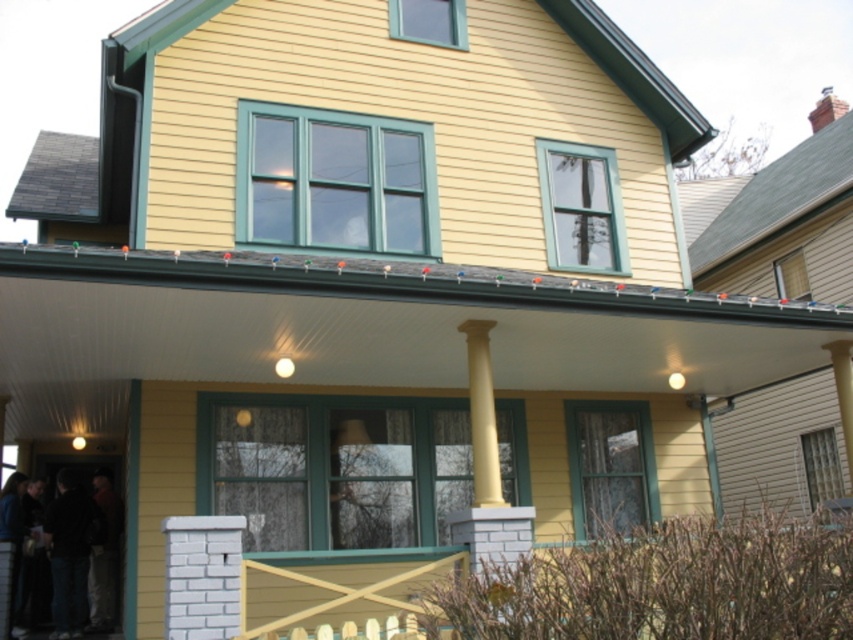
Between dark blue jeans at lower left and dark clothing at entrance, which one appears on the left side from the viewer's perspective?

dark clothing at entrance

Is point (74, 579) positioned before point (57, 611)?

No, (74, 579) is behind (57, 611).

This screenshot has height=640, width=853. What are the coordinates of `dark blue jeans at lower left` in the screenshot? It's located at (73, 548).

Image resolution: width=853 pixels, height=640 pixels. What do you see at coordinates (68, 552) in the screenshot?
I see `dark clothing at entrance` at bounding box center [68, 552].

Is dark clothing at entrance to the left of yellow smooth column at center from the viewer's perspective?

Indeed, dark clothing at entrance is positioned on the left side of yellow smooth column at center.

Is point (74, 515) more distant than point (473, 320)?

Yes, it is.

Find the location of a particular element. This screenshot has width=853, height=640. dark clothing at entrance is located at coordinates (68, 552).

How distant is dark blue jeans at lower left from yellow smooth column at center?

They are 4.94 meters apart.

This screenshot has width=853, height=640. What do you see at coordinates (73, 548) in the screenshot? I see `dark blue jeans at lower left` at bounding box center [73, 548].

Which is behind, point (107, 502) or point (473, 380)?

The point (107, 502) is more distant.

I want to click on dark blue jeans at lower left, so click(73, 548).